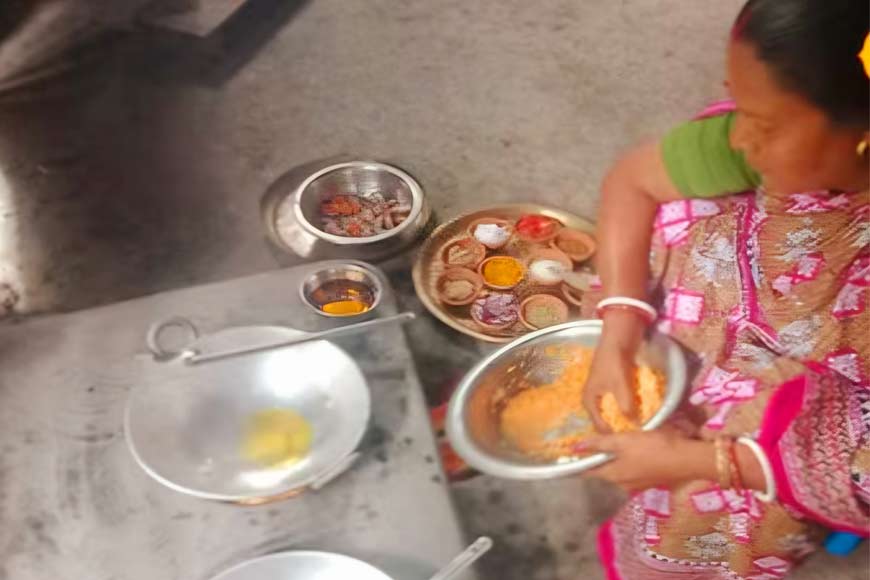
This screenshot has height=580, width=870. What are the coordinates of `bowl` in the screenshot? It's located at coord(322,387).